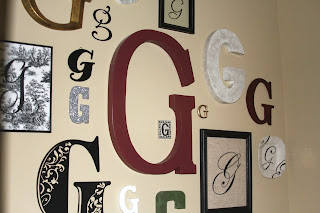
Locate an element on the screen. left side frame is located at coordinates (203, 167), (162, 5).